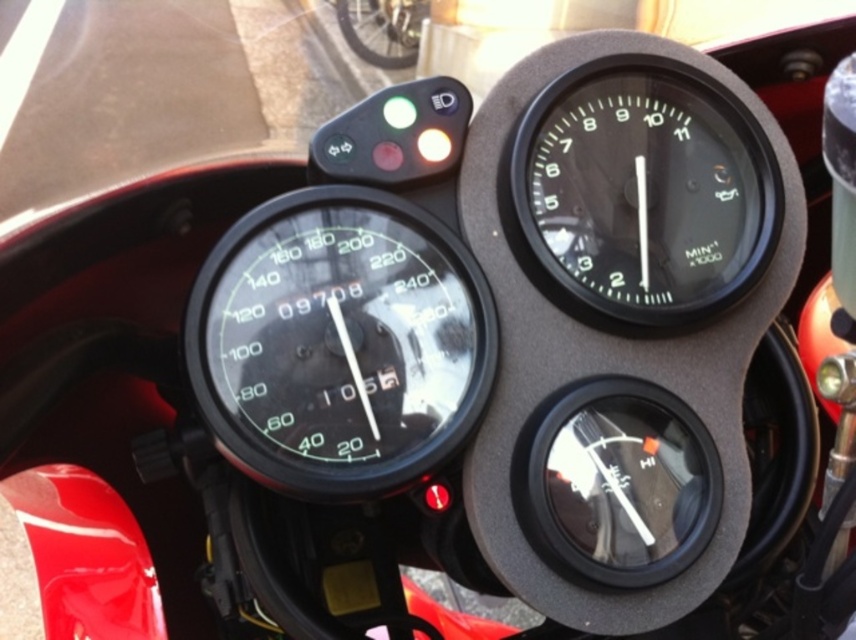
Is black glass speedometer at center shorter than black glass tachometer at upper right?

No, black glass speedometer at center is not shorter than black glass tachometer at upper right.

From the picture: Who is higher up, black glass speedometer at center or black glass tachometer at upper right?

black glass tachometer at upper right

At what (x,y) coordinates should I click in order to perform the action: click on black glass speedometer at center. Please return your answer as a coordinate pair (x, y). Image resolution: width=856 pixels, height=640 pixels. Looking at the image, I should click on (339, 342).

Locate an element on the screen. This screenshot has height=640, width=856. black glass speedometer at center is located at coordinates (339, 342).